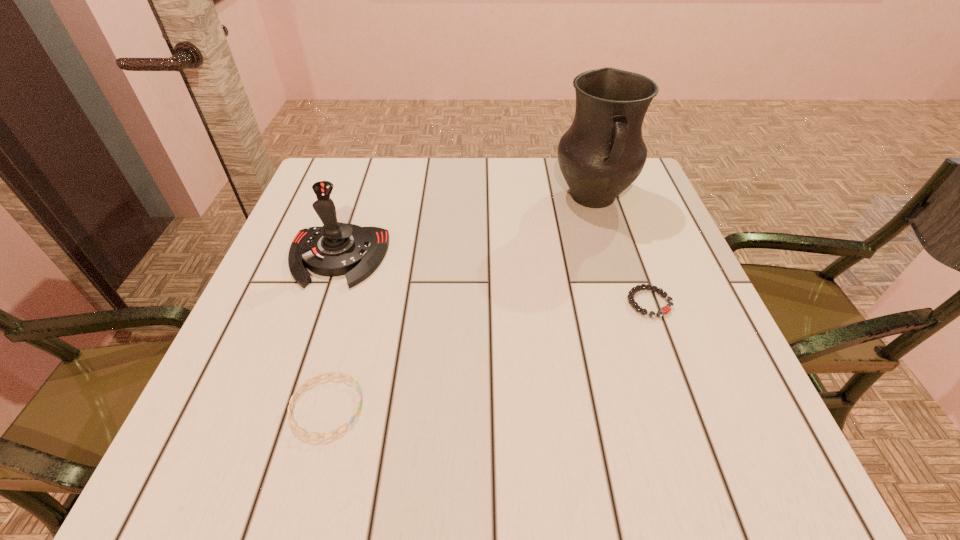
I want to click on vacant point at the near edge, so click(585, 458).

Locate an element on the screen. vacant space at the left edge of the desktop is located at coordinates (323, 226).

I want to click on free space at the right edge of the desktop, so click(656, 254).

Identify the location of vacant space at the far left corner of the desktop. (332, 183).

Locate an element on the screen. Image resolution: width=960 pixels, height=540 pixels. vacant space at the near right corner of the desktop is located at coordinates (699, 454).

At what (x,y) coordinates should I click in order to perform the action: click on free area in between the nearest object and the shortest object. Please return your answer as a coordinate pair (x, y). The height and width of the screenshot is (540, 960). Looking at the image, I should click on (488, 355).

What are the coordinates of `free space between the right bracelet and the second tallest object` in the screenshot? It's located at (x=493, y=280).

This screenshot has height=540, width=960. In order to click on free spot between the nearer bracelet and the right bracelet in this screenshot , I will do 488,355.

Where is `vacant area between the right bracelet and the pitcher`? The height and width of the screenshot is (540, 960). vacant area between the right bracelet and the pitcher is located at coordinates (621, 250).

Find the location of `vacant area that lies between the shortest object and the pitcher`. vacant area that lies between the shortest object and the pitcher is located at coordinates (621, 250).